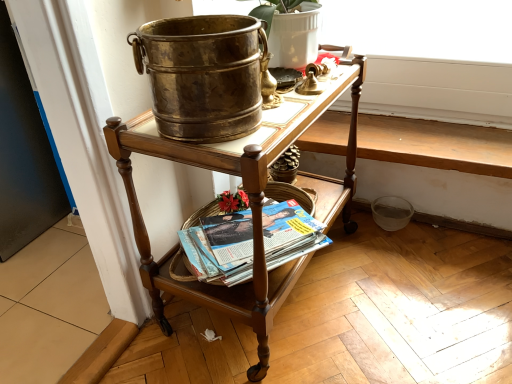
Question: Does matte white flowerpot at upper center come in front of matte paperbacks at lower center?

Choices:
 (A) yes
 (B) no

Answer: (A)

Question: Is matte white flowerpot at upper center smaller than matte paperbacks at lower center?

Choices:
 (A) no
 (B) yes

Answer: (A)

Question: Is matte white flowerpot at upper center outside of matte paperbacks at lower center?

Choices:
 (A) yes
 (B) no

Answer: (A)

Question: Would you say matte paperbacks at lower center is part of matte white flowerpot at upper center's contents?

Choices:
 (A) yes
 (B) no

Answer: (B)

Question: Is matte white flowerpot at upper center positioned far away from matte paperbacks at lower center?

Choices:
 (A) yes
 (B) no

Answer: (B)

Question: Is matte white flowerpot at upper center to the left or to the right of polished wood desk at center in the image?

Choices:
 (A) right
 (B) left

Answer: (B)

Question: In terms of size, does matte white flowerpot at upper center appear bigger or smaller than polished wood desk at center?

Choices:
 (A) big
 (B) small

Answer: (B)

Question: In the image, is matte white flowerpot at upper center positioned in front of or behind polished wood desk at center?

Choices:
 (A) front
 (B) behind

Answer: (A)

Question: Considering the positions of matte white flowerpot at upper center and polished wood desk at center in the image, is matte white flowerpot at upper center wider or thinner than polished wood desk at center?

Choices:
 (A) wide
 (B) thin

Answer: (B)

Question: Does point (308, 236) appear closer or farther from the camera than point (183, 145)?

Choices:
 (A) farther
 (B) closer

Answer: (A)

Question: In the image, is matte paperbacks at lower center on the left side or the right side of polished wood desk at center?

Choices:
 (A) right
 (B) left

Answer: (B)

Question: Is matte paperbacks at lower center wider or thinner than polished wood desk at center?

Choices:
 (A) wide
 (B) thin

Answer: (B)

Question: From the image's perspective, is matte paperbacks at lower center positioned above or below polished wood desk at center?

Choices:
 (A) above
 (B) below

Answer: (B)

Question: From their relative heights in the image, would you say matte paperbacks at lower center is taller or shorter than matte white flowerpot at upper center?

Choices:
 (A) short
 (B) tall

Answer: (A)

Question: From a real-world perspective, is matte paperbacks at lower center above or below matte white flowerpot at upper center?

Choices:
 (A) above
 (B) below

Answer: (B)